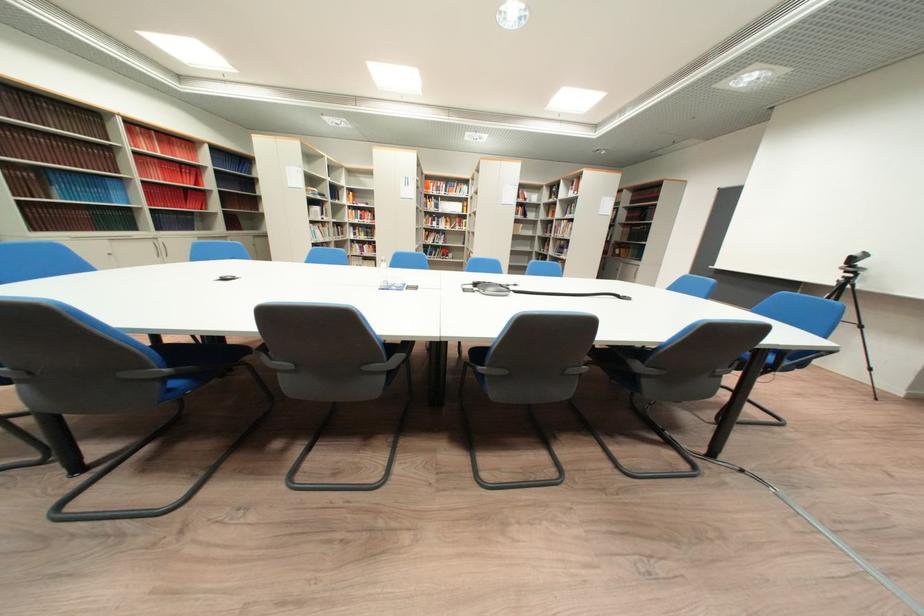
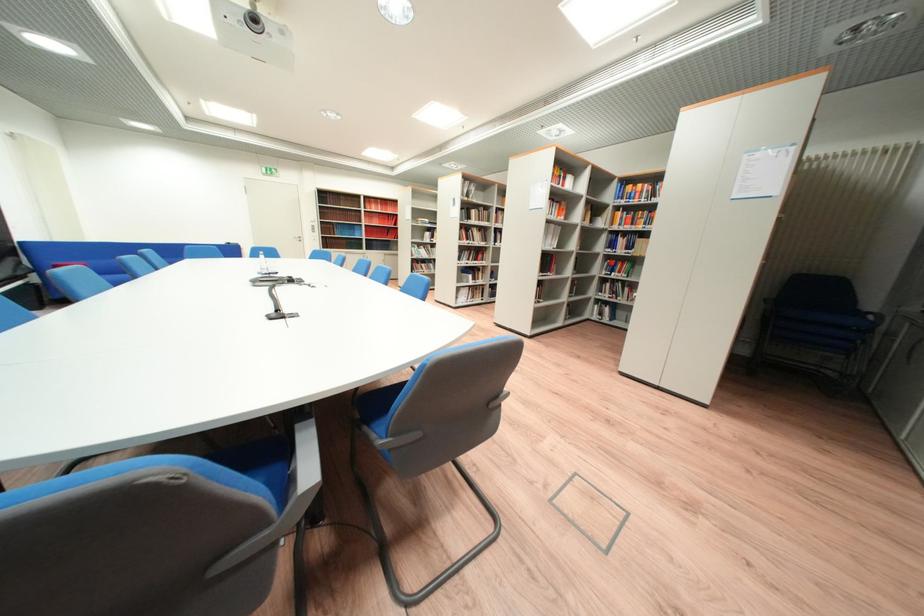
Question: I am providing you with two images of the same scene from different viewpoints. After the viewpoint changes to image2, which objects are now occluded?

Choices:
 (A) floor panel cover
 (B) blue book
 (C) blue chair sitting surface
 (D) silver push-button lock

Answer: (C)